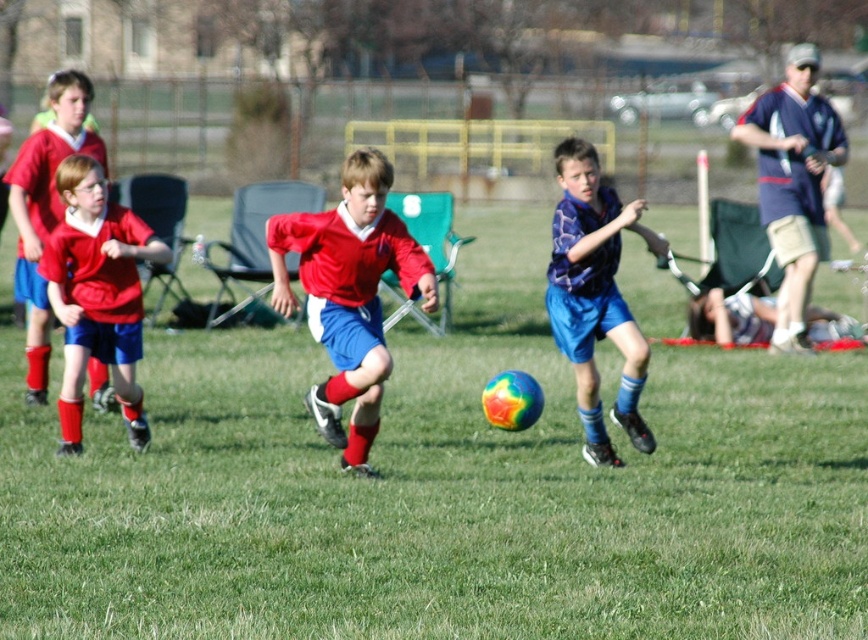
You are a photographer standing at the center of the soccer field. You want to take a photo of the blue fabric cap at upper right. To do that, in which direction should you move your camera? Please answer with either left, right, up, or down.

The blue fabric cap at upper right is located at point (793, 182). Since the y coordinate is 0.915, which is near the top of the image, you should move your camera upward to capture it.

You are a soccer coach analyzing the match. The field is divided into a grid with coordinates from 0 to 1 in both x and y directions. The center of the field is at coordinate point 0.5, 0.5. Where is the matte red shirt at center located relative to the field center?

The matte red shirt at center is located at point (349, 294), which is slightly to the left and below the field center at (434, 320).

You are standing at the edge of the soccer field and want to throw a ball to the point marked as point (63, 180). If you can throw the ball 30 feet, will you be able to reach that point?

The point (63, 180) is 32.18 feet away from the viewer. Since you can throw 30 feet, you will not be able to reach that point.